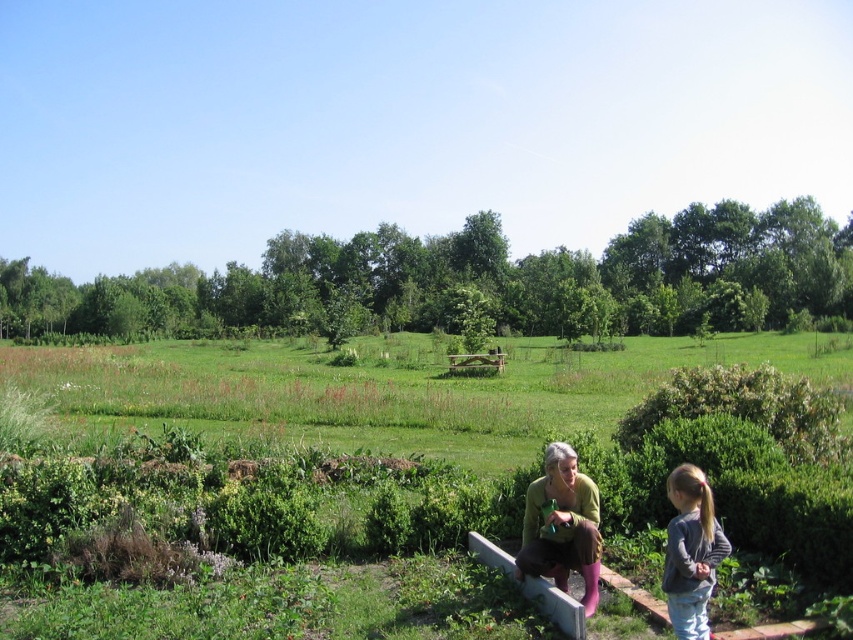
Can you confirm if green grass at lower center is positioned above gray fleece jacket at lower right?

No, green grass at lower center is not above gray fleece jacket at lower right.

Measure the distance between green grass at lower center and camera.

green grass at lower center and camera are 5.54 meters apart from each other.

Identify the location of green grass at lower center. (271, 454).

Between green leafy hedge at center and green knitted sweater at lower center, which one appears on the right side from the viewer's perspective?

green knitted sweater at lower center is more to the right.

Does green leafy hedge at center come in front of green knitted sweater at lower center?

No, green leafy hedge at center is behind green knitted sweater at lower center.

Who is more distant from viewer, (682, 241) or (582, 481)?

The point (682, 241) is more distant.

This screenshot has height=640, width=853. I want to click on green leafy hedge at center, so click(479, 280).

You are a GUI agent. You are given a task and a screenshot of the screen. Output one action in this format:
    pyautogui.click(x=<x>, y=<y>)
    Task: Click on the green leafy hedge at center
    The width and height of the screenshot is (853, 640).
    Given the screenshot: What is the action you would take?
    pyautogui.click(x=479, y=280)

Is point (289, 291) farther from camera compared to point (691, 518)?

Yes, it is behind point (691, 518).

This screenshot has height=640, width=853. I want to click on green leafy hedge at center, so click(x=479, y=280).